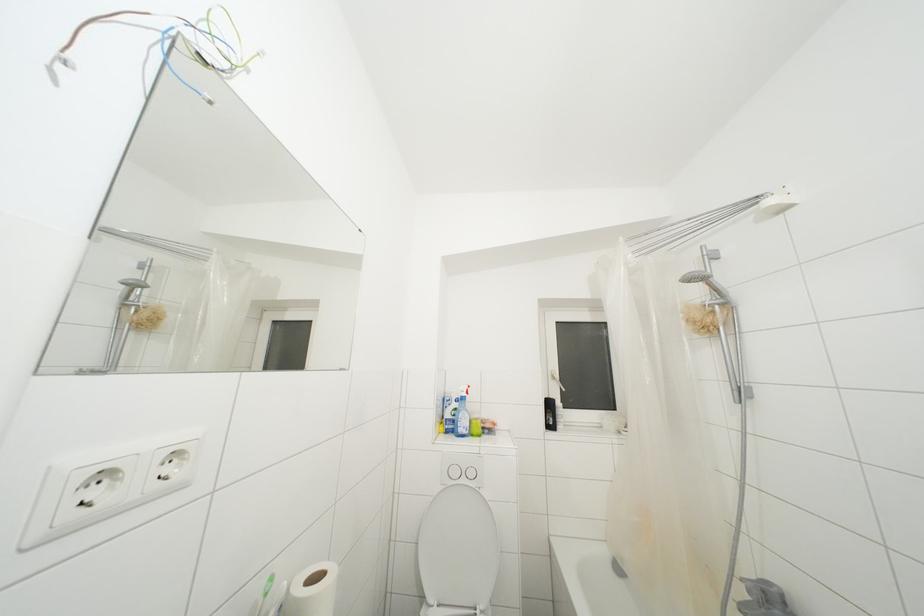
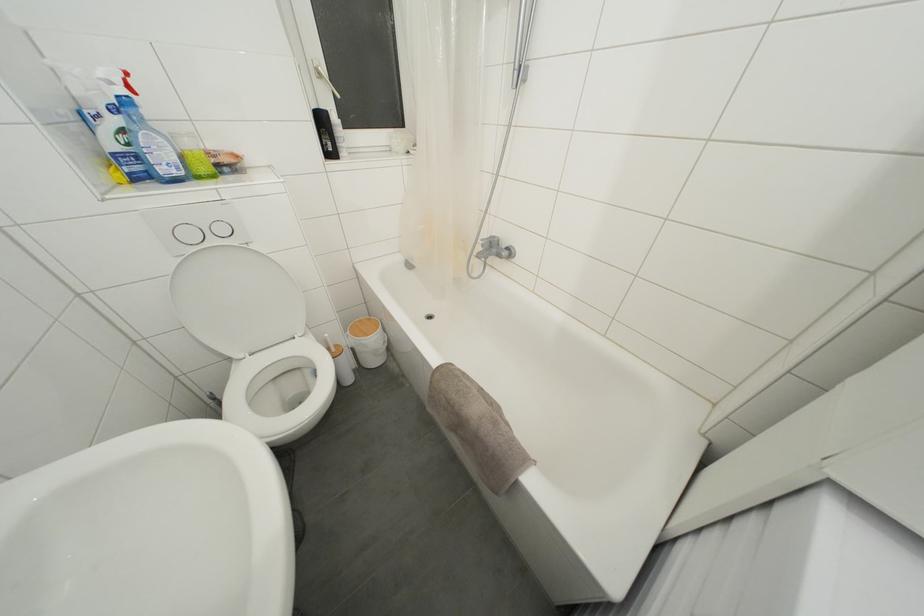
The point at (748, 576) is marked in the first image. Where is the corresponding point in the second image?

(488, 240)